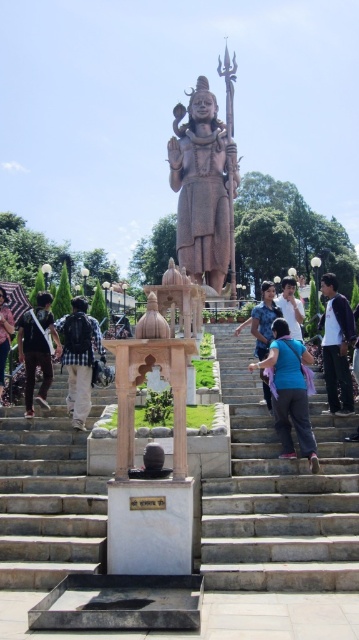
Is point (231, 576) farther from viewer compared to point (299, 337)?

No, (231, 576) is closer to viewer.

Is stone stairs at center shorter than light blue shirt at center?

In fact, stone stairs at center may be taller than light blue shirt at center.

You are a GUI agent. You are given a task and a screenshot of the screen. Output one action in this format:
    pyautogui.click(x=<x>, y=<y>)
    Task: Click on the stone stairs at center
    
    Given the screenshot: What is the action you would take?
    pyautogui.click(x=277, y=493)

Identify the location of stone stairs at center. (277, 493).

Is white marble stairs at center shorter than checkered fabric backpack at center?

Incorrect, white marble stairs at center's height does not fall short of checkered fabric backpack at center's.

Where is `white marble stairs at center`? white marble stairs at center is located at coordinates (277, 497).

Which is behind, point (351, 454) or point (67, 324)?

The point (67, 324) is more distant.

Locate an element on the screen. This screenshot has width=359, height=640. white marble stairs at center is located at coordinates click(277, 497).

Looking at this image, does stone stairs at center appear on the right side of blue fabric at center?

Correct, you'll find stone stairs at center to the right of blue fabric at center.

Between stone stairs at center and blue fabric at center, which one appears on the right side from the viewer's perspective?

Positioned to the right is stone stairs at center.

The image size is (359, 640). I want to click on stone stairs at center, so click(x=277, y=493).